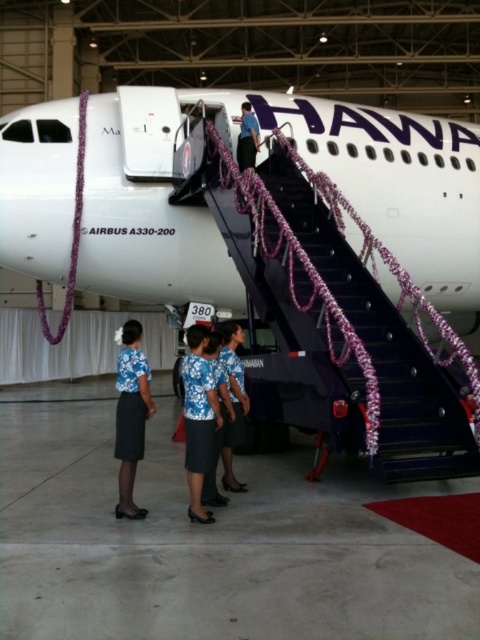
Question: Does gray concrete tarmac at lower center appear on the right side of white glossy airplane at center?

Choices:
 (A) no
 (B) yes

Answer: (B)

Question: Estimate the real-world distances between objects in this image. Which object is farther from the blue floral dress at center?

Choices:
 (A) floral fabric dress at center
 (B) gray concrete tarmac at lower center

Answer: (B)

Question: Does purple fabric staircase at center have a greater width compared to blue fabric skirt at lower center?

Choices:
 (A) no
 (B) yes

Answer: (B)

Question: Is the position of purple fabric staircase at center less distant than that of blue fabric skirt at lower center?

Choices:
 (A) no
 (B) yes

Answer: (A)

Question: Which of the following is the farthest from the observer?

Choices:
 (A) (130, 516)
 (B) (47, 400)

Answer: (B)

Question: Which point is closer to the camera?

Choices:
 (A) (239, 336)
 (B) (142, 422)
 (C) (41, 102)

Answer: (B)